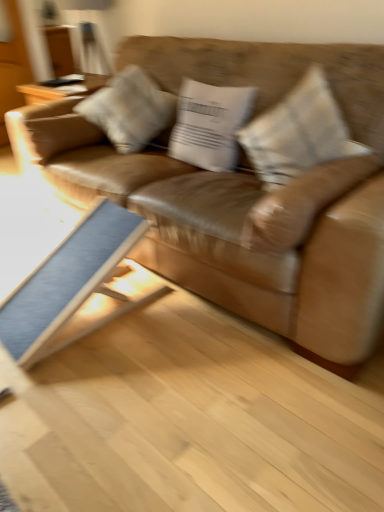
The image size is (384, 512). I want to click on unoccupied region to the right of blue fabric table at lower left, so click(182, 333).